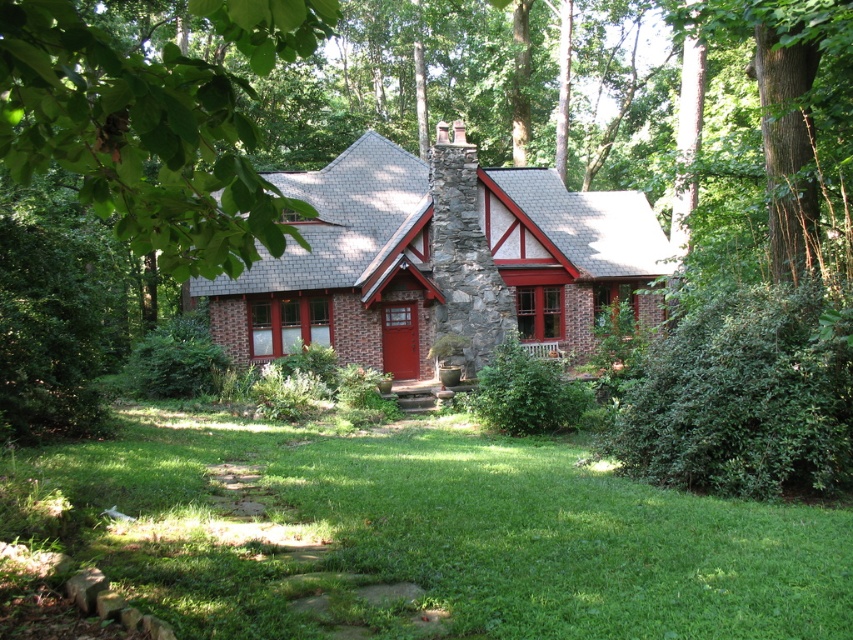
You are standing in front of the house and want to walk to the green grass at center. Based on the coordinates provided, in which direction should you move relative to your current position?

The green grass at center is located at coordinates point [434,536], so you should move towards the center of the image to reach it.

You are standing in front of the house and want to walk towards the brick house at center. Which direction should you move relative to the green grass at center?

Since the green grass at center is closer to the viewer than the brick house at center, you should move away from the green grass at center to reach the brick house at center.